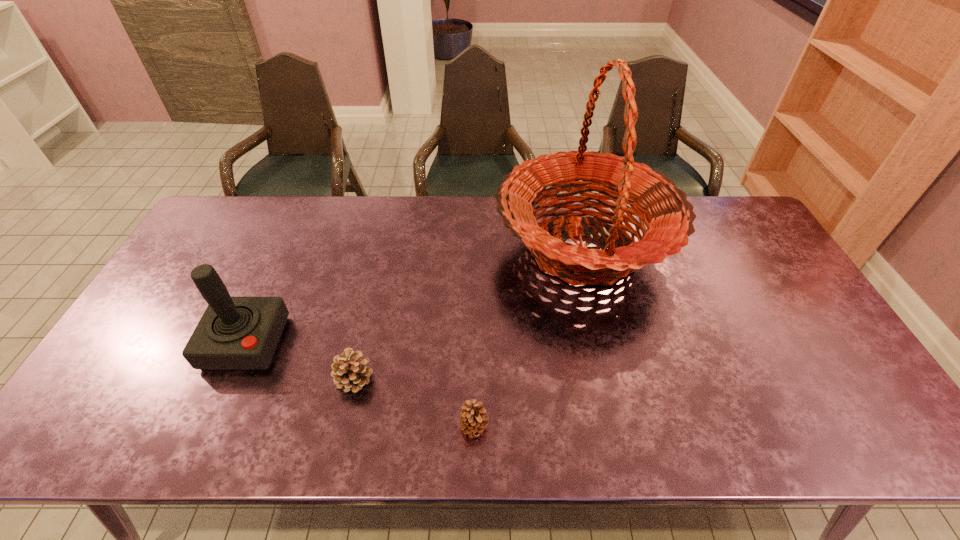
This screenshot has width=960, height=540. In order to click on the rightmost object in this screenshot , I will do `click(668, 216)`.

At what (x,y) coordinates should I click in order to perform the action: click on basket. Please return your answer as a coordinate pair (x, y). The height and width of the screenshot is (540, 960). Looking at the image, I should click on (668, 216).

Image resolution: width=960 pixels, height=540 pixels. I want to click on joystick, so click(234, 332).

Locate an element on the screen. The width and height of the screenshot is (960, 540). the third shortest object is located at coordinates (234, 332).

You are a GUI agent. You are given a task and a screenshot of the screen. Output one action in this format:
    pyautogui.click(x=<x>, y=<y>)
    Task: Click on the second object from left to right
    This screenshot has width=960, height=540.
    Given the screenshot: What is the action you would take?
    pyautogui.click(x=349, y=371)

Find the location of a particular element. the farther pinecone is located at coordinates (349, 371).

This screenshot has width=960, height=540. I want to click on the nearest object, so click(x=473, y=418).

Where is `the right pinecone`? Image resolution: width=960 pixels, height=540 pixels. the right pinecone is located at coordinates (473, 418).

You are a GUI agent. You are given a task and a screenshot of the screen. Output one action in this format:
    pyautogui.click(x=<x>, y=<y>)
    Task: Click on the vacant area situated 0.070m on the left of the tallest object
    This screenshot has width=960, height=540.
    Given the screenshot: What is the action you would take?
    pyautogui.click(x=472, y=248)

What are the coordinates of `free space located 0.170m on the base of the second tallest object` in the screenshot? It's located at pos(203,439).